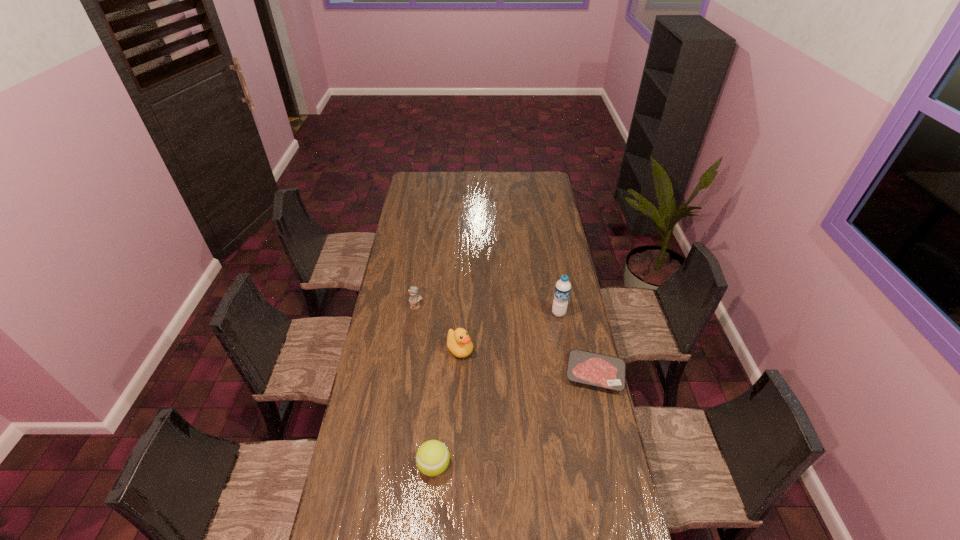
Where is `tennis ball`? Image resolution: width=960 pixels, height=540 pixels. tennis ball is located at coordinates (432, 458).

Where is `steak`? The image size is (960, 540). steak is located at coordinates (584, 367).

Locate an element on the screen. Image resolution: width=960 pixels, height=540 pixels. water bottle is located at coordinates click(562, 288).

Identify the location of teddy bear. This screenshot has width=960, height=540. (414, 298).

Locate an element on the screen. The image size is (960, 540). duck is located at coordinates (458, 342).

The image size is (960, 540). Identify the location of free spot located 0.080m on the right of the nearest object. (474, 465).

Locate an element on the screen. vacant space located 0.170m on the front of the steak is located at coordinates (610, 437).

This screenshot has width=960, height=540. I want to click on free spot located 0.350m on the label of the water bottle, so click(527, 377).

I want to click on blank space located 0.360m on the label of the water bottle, so click(x=526, y=379).

You are a GUI agent. You are given a task and a screenshot of the screen. Output one action in this format:
    pyautogui.click(x=<x>, y=<y>)
    Task: Click on the free space located 0.400m on the label of the water bottle
    This screenshot has width=960, height=540.
    Given the screenshot: What is the action you would take?
    pyautogui.click(x=522, y=387)